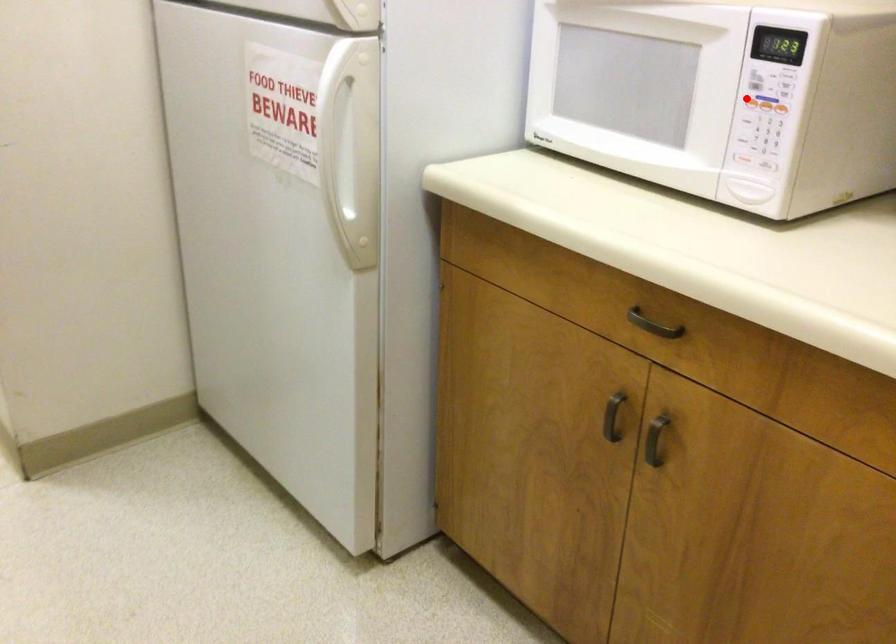
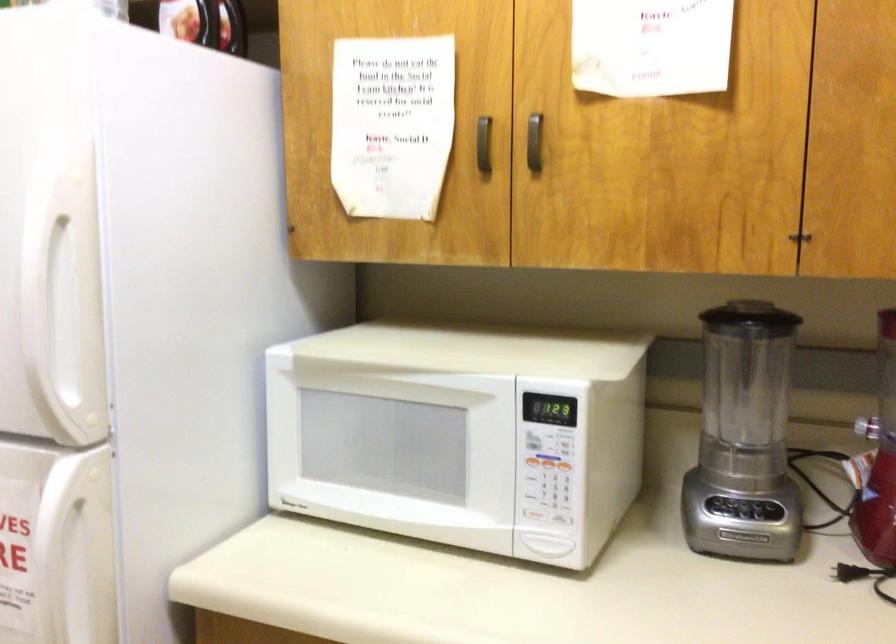
Where in the second image is the point corresponding to the highlighted location from the first image?

(530, 462)